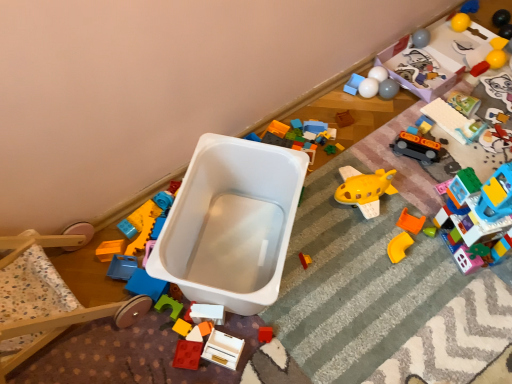
Where is `unoccupied space behind matte yellow toy airplane at center, placed as the 12th toy when sorted from right to left`? This screenshot has width=512, height=384. unoccupied space behind matte yellow toy airplane at center, placed as the 12th toy when sorted from right to left is located at coordinates (305, 221).